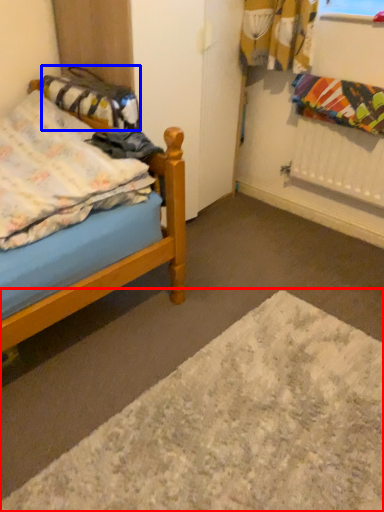
Question: Which of the following is the closest to the observer, plain (highlighted by a red box) or material (highlighted by a blue box)?

Choices:
 (A) plain
 (B) material

Answer: (A)